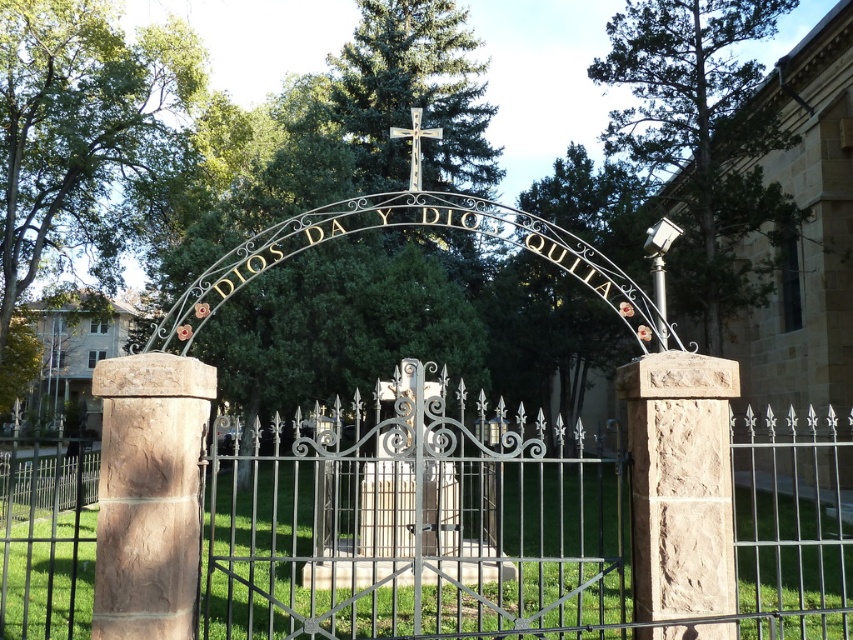
Question: Is stone church at left smaller than metallic cross at center?

Choices:
 (A) no
 (B) yes

Answer: (A)

Question: Can you confirm if stone church at left is thinner than metallic cross at center?

Choices:
 (A) no
 (B) yes

Answer: (A)

Question: Which point is closer to the camera?

Choices:
 (A) click(x=42, y=308)
 (B) click(x=84, y=568)
 (C) click(x=392, y=131)

Answer: (C)

Question: Estimate the real-world distances between objects in this image. Which object is closer to the black wrought iron fence at center?

Choices:
 (A) metallic cross at center
 (B) stone church at left

Answer: (A)

Question: Which object is farther from the camera taking this photo?

Choices:
 (A) stone church at left
 (B) black wrought iron fence at center

Answer: (A)

Question: Is black wrought iron fence at center to the left of metallic cross at center from the viewer's perspective?

Choices:
 (A) no
 (B) yes

Answer: (B)